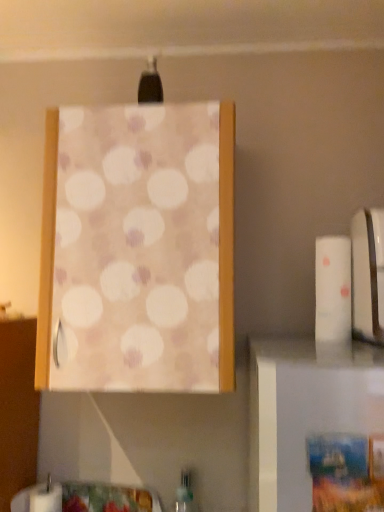
What do you see at coordinates (138, 250) in the screenshot? I see `matte fabric curtain at upper center` at bounding box center [138, 250].

The image size is (384, 512). Describe the element at coordinates (333, 298) in the screenshot. I see `white matte toilet paper at right` at that location.

Locate an element on the screen. This screenshot has width=384, height=512. white glossy toaster at right is located at coordinates (367, 273).

Image resolution: width=384 pixels, height=512 pixels. Find the location of `wooden frame at upper center`. wooden frame at upper center is located at coordinates (304, 413).

Is white matte toilet paper at right positioned with its back to wooden frame at upper center?

That's not correct — white matte toilet paper at right is not looking away from wooden frame at upper center.

Considering the positions of point (335, 280) and point (265, 461), is point (335, 280) closer or farther from the camera than point (265, 461)?

Point (335, 280) is farther from the camera than point (265, 461).

Considering the sizes of objects white matte toilet paper at right and wooden frame at upper center in the image provided, who is wider, white matte toilet paper at right or wooden frame at upper center?

white matte toilet paper at right is wider.

Which is less distant, (194,502) or (297,426)?

The point (297,426) is in front.

Is green translucent bottle at lower center thinner than wooden frame at upper center?

Incorrect, the width of green translucent bottle at lower center is not less than that of wooden frame at upper center.

In the scene shown: Which is more to the left, green translucent bottle at lower center or wooden frame at upper center?

From the viewer's perspective, green translucent bottle at lower center appears more on the left side.

Is green translucent bottle at lower center next to wooden frame at upper center?

green translucent bottle at lower center and wooden frame at upper center are clearly separated.

You are a GUI agent. You are given a task and a screenshot of the screen. Output one action in this format:
    pyautogui.click(x=<x>, y=<y>)
    Task: Click on the toilet paper lying on the left of white glossy toaster at right
    The height and width of the screenshot is (512, 384).
    Given the screenshot: What is the action you would take?
    pyautogui.click(x=333, y=298)

What's the angular difference between white glossy toaster at right and white matte toilet paper at right's facing directions?

The facing directions of white glossy toaster at right and white matte toilet paper at right are 0.000632 degrees apart.

Who is shorter, white glossy toaster at right or white matte toilet paper at right?

white matte toilet paper at right.

Can you confirm if white glossy toaster at right is smaller than white matte toilet paper at right?

Actually, white glossy toaster at right might be larger than white matte toilet paper at right.

From a real-world perspective, between matte fabric curtain at upper center and wooden frame at upper center, who is vertically lower?

From a 3D spatial view, wooden frame at upper center is below.

Which is less distant, (196, 182) or (360, 380)?

The point (360, 380) is closer.

You are a GUI agent. You are given a task and a screenshot of the screen. Output one action in this format:
    pyautogui.click(x=<x>, y=<y>)
    Task: Click on the curtain that is above the wooden frame at upper center (from a real-world perspective)
    This screenshot has width=384, height=512.
    Given the screenshot: What is the action you would take?
    pyautogui.click(x=138, y=250)

What's the angular difference between matte fabric curtain at upper center and wooden frame at upper center's facing directions?

0.0023 degrees separate the facing orientations of matte fabric curtain at upper center and wooden frame at upper center.

Is wooden frame at upper center further to camera compared to white matte toilet paper at right?

No, it is in front of white matte toilet paper at right.

What's the angular difference between wooden frame at upper center and white matte toilet paper at right's facing directions?

0.00219 degrees separate the facing orientations of wooden frame at upper center and white matte toilet paper at right.

Would you say white matte toilet paper at right is part of wooden frame at upper center's contents?

No, white matte toilet paper at right is not surrounded by wooden frame at upper center.

Is wooden frame at upper center facing towards white matte toilet paper at right?

No, wooden frame at upper center is not turned towards white matte toilet paper at right.

Is white matte toilet paper at right wider or thinner than green translucent bottle at lower center?

white matte toilet paper at right is wider than green translucent bottle at lower center.

Considering the relative sizes of white matte toilet paper at right and green translucent bottle at lower center in the image provided, is white matte toilet paper at right taller than green translucent bottle at lower center?

In fact, white matte toilet paper at right may be shorter than green translucent bottle at lower center.

Is white matte toilet paper at right completely or partially outside of green translucent bottle at lower center?

Yes, white matte toilet paper at right is outside of green translucent bottle at lower center.

Locate an element on the screen. curtain above the white matte toilet paper at right (from the image's perspective) is located at coordinates (138, 250).

How many degrees apart are the facing directions of matte fabric curtain at upper center and white matte toilet paper at right?

There is a 0.000127-degree angle between the facing directions of matte fabric curtain at upper center and white matte toilet paper at right.

From the image's perspective, which is above, matte fabric curtain at upper center or white matte toilet paper at right?

matte fabric curtain at upper center, from the image's perspective.

Where is `toilet paper above the wooden frame at upper center (from a real-world perspective)`? The image size is (384, 512). toilet paper above the wooden frame at upper center (from a real-world perspective) is located at coordinates (333, 298).

Where is `furniture in front of the green translucent bottle at lower center`? furniture in front of the green translucent bottle at lower center is located at coordinates (304, 413).

From the image, which object appears to be farther from white matte toilet paper at right, wooden frame at upper center or green translucent bottle at lower center?

The object further to white matte toilet paper at right is green translucent bottle at lower center.

Looking at this image, when comparing their distances from matte fabric curtain at upper center, does wooden frame at upper center or white matte toilet paper at right seem closer?

white matte toilet paper at right is closer to matte fabric curtain at upper center.

From the picture: When comparing their distances from green translucent bottle at lower center, does white matte toilet paper at right or wooden frame at upper center seem closer?

white matte toilet paper at right.

Looking at the image, which one is located further to matte fabric curtain at upper center, green translucent bottle at lower center or white matte toilet paper at right?

green translucent bottle at lower center is further to matte fabric curtain at upper center.

Looking at the image, which one is located closer to white glossy toaster at right, green translucent bottle at lower center or white matte toilet paper at right?

white matte toilet paper at right is closer to white glossy toaster at right.

Estimate the real-world distances between objects in this image. Which object is closer to matte fabric curtain at upper center, white glossy toaster at right or white matte toilet paper at right?

white matte toilet paper at right is positioned closer to the anchor matte fabric curtain at upper center.

Which object lies further to the anchor point white glossy toaster at right, matte fabric curtain at upper center or wooden frame at upper center?

matte fabric curtain at upper center.

In the scene shown: Estimate the real-world distances between objects in this image. Which object is further from white glossy toaster at right, wooden frame at upper center or matte fabric curtain at upper center?

Based on the image, matte fabric curtain at upper center appears to be further to white glossy toaster at right.

At what (x,y) coordinates should I click in order to perform the action: click on appliance between matte fabric curtain at upper center and green translucent bottle at lower center from top to bottom. Please return your answer as a coordinate pair (x, y). The height and width of the screenshot is (512, 384). Looking at the image, I should click on (367, 273).

This screenshot has width=384, height=512. I want to click on toilet paper between matte fabric curtain at upper center and green translucent bottle at lower center vertically, so click(x=333, y=298).

The height and width of the screenshot is (512, 384). I want to click on toilet paper between matte fabric curtain at upper center and white glossy toaster at right, so click(x=333, y=298).

Image resolution: width=384 pixels, height=512 pixels. In order to click on appliance between wooden frame at upper center and white matte toilet paper at right in the front-back direction in this screenshot , I will do `click(367, 273)`.